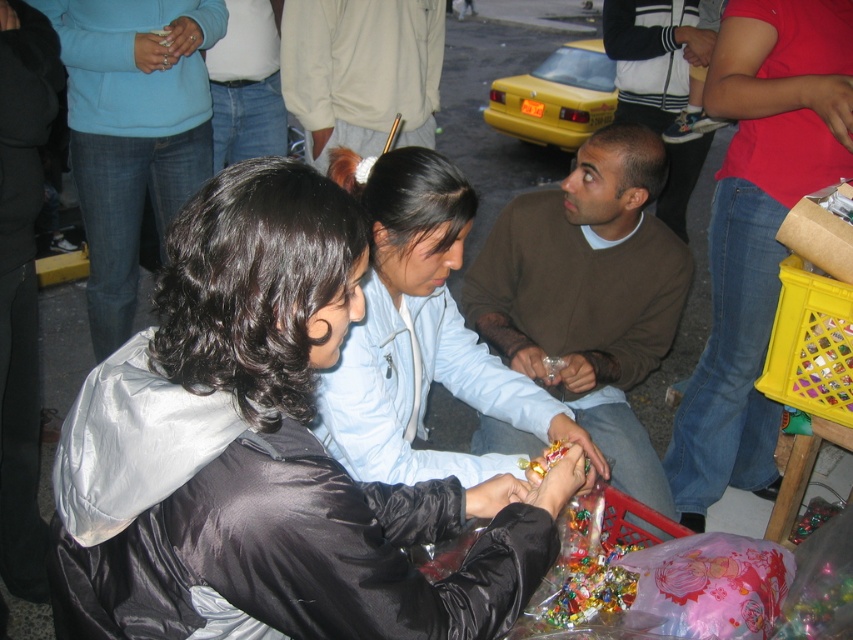
Who is lower down, brown sweater at center or light beige sweater at center?

brown sweater at center

Does brown sweater at center appear over light beige sweater at center?

Actually, brown sweater at center is below light beige sweater at center.

This screenshot has width=853, height=640. I want to click on brown sweater at center, so click(589, 294).

Is silky black jacket at center above brown sweater at center?

Actually, silky black jacket at center is below brown sweater at center.

Identify the location of silky black jacket at center. The width and height of the screenshot is (853, 640). (273, 452).

Can you confirm if denim jeans at lower right is positioned above light beige sweater at center?

No.

Which is behind, point (714, 394) or point (341, 33)?

The point (341, 33) is behind.

Is point (778, 104) in front of point (432, 145)?

Yes.

This screenshot has height=640, width=853. Identify the location of denim jeans at lower right. (757, 228).